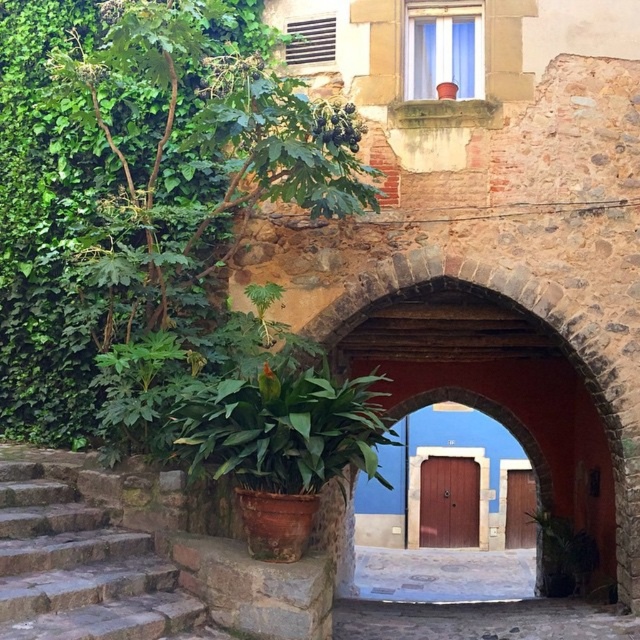
Question: Which object is positioned farthest from the brown wooden door at center?

Choices:
 (A) green leafy plant at left
 (B) green matte plant at center
 (C) brown stone stairs at lower left

Answer: (C)

Question: Is brown stone stairs at lower left to the left of green leafy plant at lower right from the viewer's perspective?

Choices:
 (A) no
 (B) yes

Answer: (B)

Question: From the image, what is the correct spatial relationship of green matte plant at center in relation to wooden door at center?

Choices:
 (A) left
 (B) right

Answer: (A)

Question: Does green leafy plant at left have a lesser width compared to green leafy plant at lower right?

Choices:
 (A) yes
 (B) no

Answer: (B)

Question: Among these objects, which one is farthest from the camera?

Choices:
 (A) brown stone stairs at lower left
 (B) green leafy plant at lower right
 (C) wooden door at center
 (D) green leafy plant at left

Answer: (C)

Question: Which object is the closest to the brown wooden door at center?

Choices:
 (A) brown stone stairs at lower left
 (B) green matte plant at center
 (C) wooden door at center
 (D) green leafy plant at left

Answer: (C)